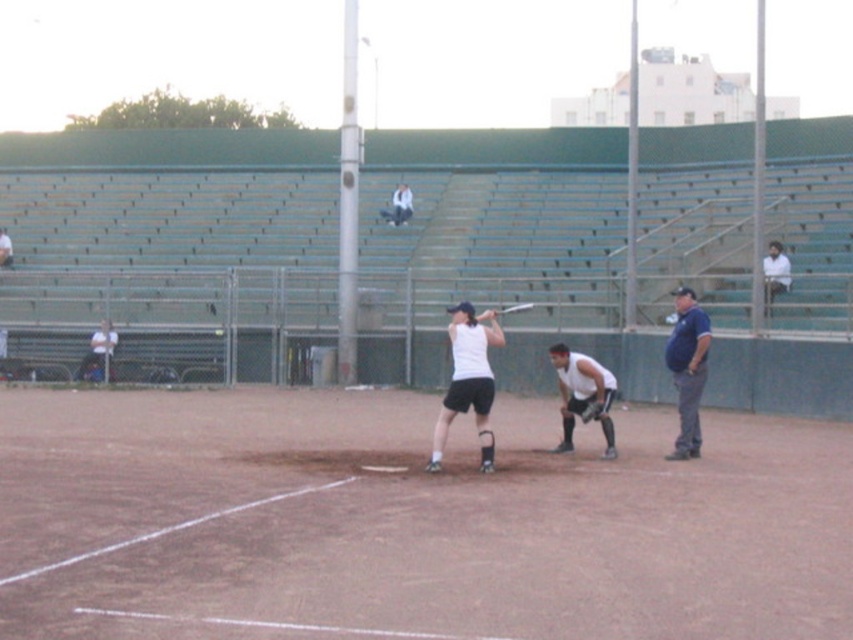
Measure the distance from white cotton shirt at center to metallic silver bat at center.

→ They are 6.17 meters apart.

Does white cotton shirt at center have a larger size compared to metallic silver bat at center?

No, white cotton shirt at center is not bigger than metallic silver bat at center.

Identify the location of white cotton shirt at center. (398, 205).

Image resolution: width=853 pixels, height=640 pixels. Find the location of `white cotton shirt at center`. white cotton shirt at center is located at coordinates (398, 205).

From the picture: Is brown dirt field at center further to camera compared to blue shirt at right?

No.

Can you confirm if brown dirt field at center is positioned above blue shirt at right?

No.

Image resolution: width=853 pixels, height=640 pixels. Find the location of `brown dirt field at center`. brown dirt field at center is located at coordinates (409, 522).

Which is in front, point (677, 304) or point (764, 278)?

Positioned in front is point (677, 304).

Can you confirm if blue shirt at right is smaller than white shirt at upper right?

Indeed, blue shirt at right has a smaller size compared to white shirt at upper right.

Which is in front, point (705, 376) or point (769, 278)?

Point (705, 376) is in front.

Find the location of a particular element. blue shirt at right is located at coordinates (688, 369).